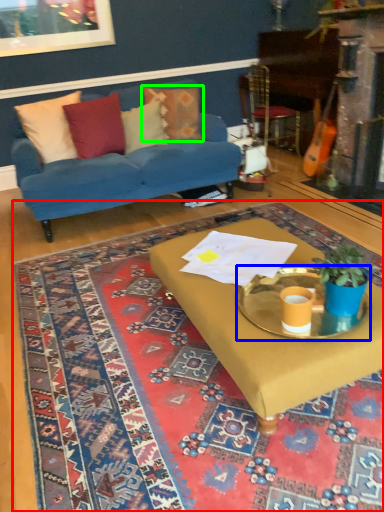
Question: Estimate the real-world distances between objects in this image. Which object is farther from mat (highlighted by a red box), round table (highlighted by a blue box) or pillow (highlighted by a green box)?

Choices:
 (A) round table
 (B) pillow

Answer: (B)